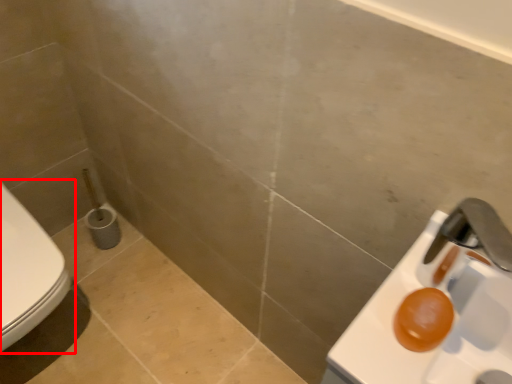
Question: In this image, where is toilet (annotated by the red box) located relative to sink?

Choices:
 (A) left
 (B) right

Answer: (A)